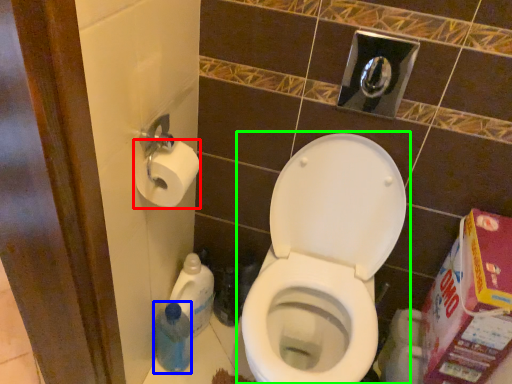
Question: Considering the real-world distances, which object is farthest from toilet paper (highlighted by a red box)? cleaning product (highlighted by a blue box) or toilet (highlighted by a green box)?

Choices:
 (A) cleaning product
 (B) toilet

Answer: (A)